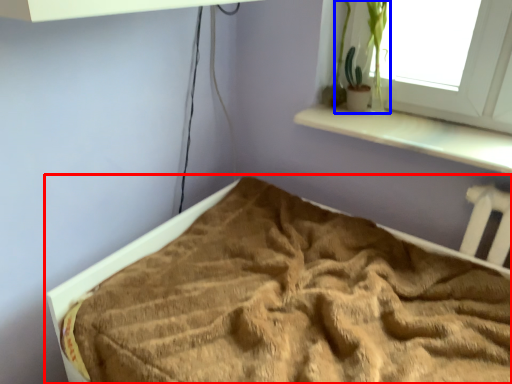
Question: Among these objects, which one is farthest to the camera, bed (highlighted by a red box) or plant (highlighted by a blue box)?

Choices:
 (A) bed
 (B) plant

Answer: (B)